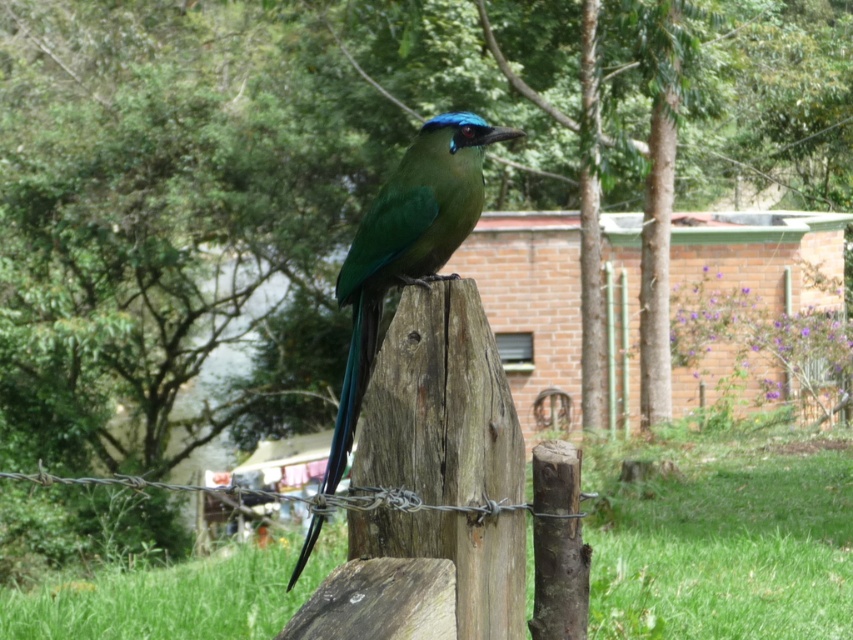
You are standing in front of the rustic fence with the vibrant bird. There are two points marked on the fence posts. Which point is closer to you, point (457, 333) or point (384, 492)?

Point (384, 492) is closer to you because the description states that point (457, 333) is further to the camera than point (384, 492).

Looking at this image, you are a photographer aiming to capture the green glossy bird at center and the barbed wire at center in a single shot. Which object should you focus on first if you want to ensure both are in sharp focus, considering their sizes?

The barbed wire at center should be focused on first because the green glossy bird at center is narrower than the barbed wire at center, allowing for a greater depth of field when focusing on the wider object.